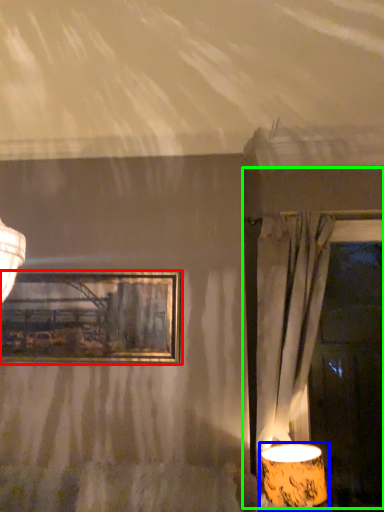
Question: Considering the real-world distances, which object is farthest from picture frame (highlighted by a red box)? lamp (highlighted by a blue box) or window frame (highlighted by a green box)?

Choices:
 (A) lamp
 (B) window frame

Answer: (A)